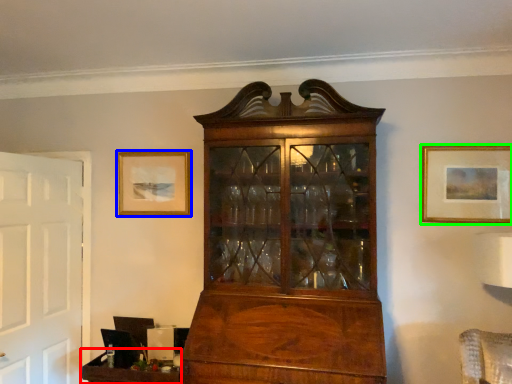
Question: Which is nearer to the table (highlighted by a red box)? picture frame (highlighted by a blue box) or picture frame (highlighted by a green box).

Choices:
 (A) picture frame
 (B) picture frame

Answer: (A)